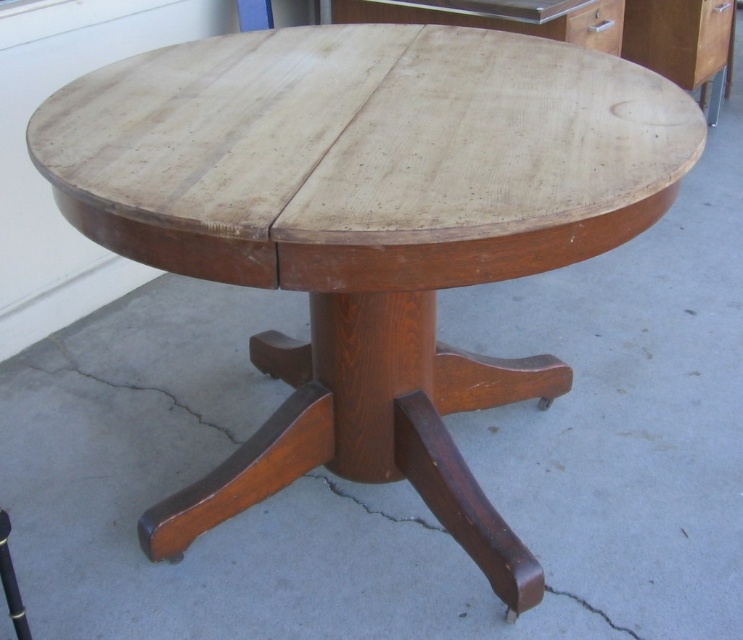
Question: Is glossy wood drawer at upper right further to camera compared to matte wood drawer at upper right?

Choices:
 (A) yes
 (B) no

Answer: (A)

Question: Is glossy wood drawer at upper right thinner than matte wood drawer at upper right?

Choices:
 (A) yes
 (B) no

Answer: (B)

Question: Which of the following is the farthest from the observer?

Choices:
 (A) click(x=726, y=42)
 (B) click(x=613, y=10)

Answer: (A)

Question: Which point is farther to the camera?

Choices:
 (A) (710, 26)
 (B) (594, 10)

Answer: (A)

Question: Is glossy wood drawer at upper right positioned before matte wood drawer at upper right?

Choices:
 (A) yes
 (B) no

Answer: (B)

Question: Which point is farther to the camera?

Choices:
 (A) (700, 33)
 (B) (580, 10)

Answer: (A)